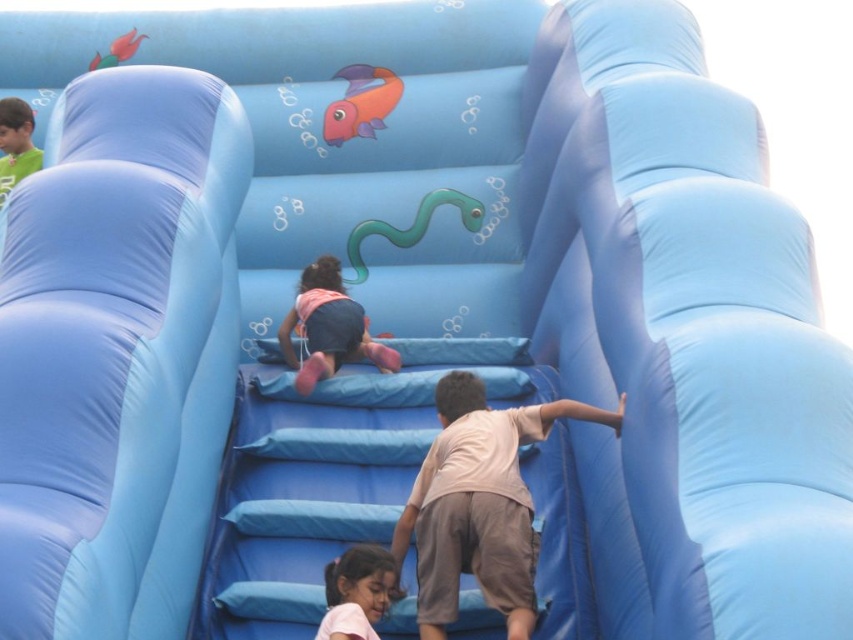
You are standing at the location of the viewer and want to hand a water bottle to the child wearing the light brown cotton shirt at center. Based on the distance provided, can you reach them without moving closer?

The light brown cotton shirt at center is 39.60 meters from the viewer, which is too far to reach without moving closer.

You are a parent supervising children at a playground. You notice the light brown cotton shirt at center and the matte pink shorts at lower center. Which child is higher up on the slide?

The light brown cotton shirt at center is positioned over the matte pink shorts at lower center, meaning the child wearing the light brown cotton shirt at center is higher up on the slide.